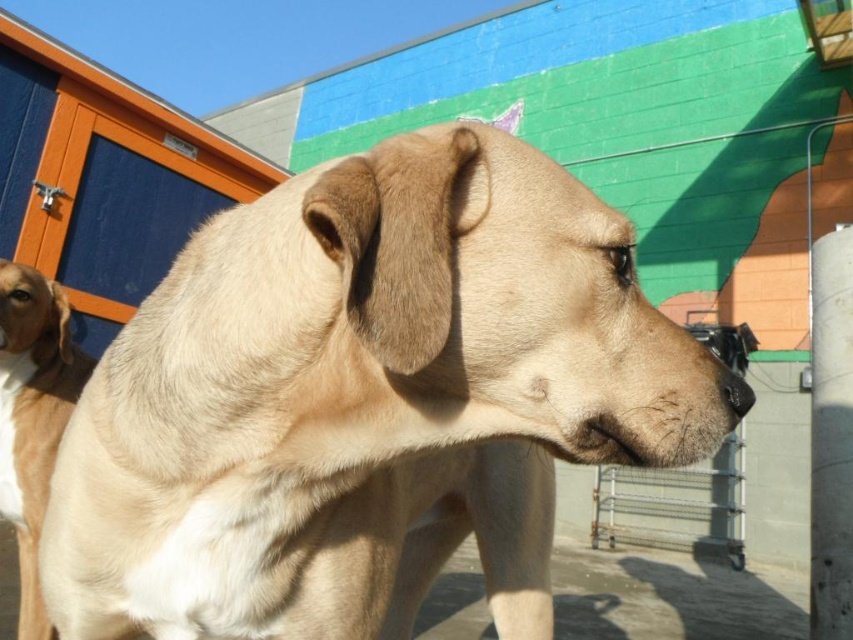
You are a photographer setting up a shoot with the fuzzy beige dog at center and the light brown fur at left. Which of the two subjects should you focus on if you want to capture the larger subject in your frame?

The fuzzy beige dog at center is larger in size than the light brown fur at left, so you should focus on the fuzzy beige dog at center to capture the larger subject in your frame.

You are a photographer trying to capture the fuzzy beige dog at center and the light brown fur at left in the same frame. Based on their positions, which one is higher up in the image?

The fuzzy beige dog at center is located above the light brown fur at left, so it is higher up in the image.

From the picture: You are a photographer trying to capture a clear shot of the fuzzy beige dog at center and the light brown fur at left. Since the dog is moving, you need to focus your camera first. Which object should you focus on first to ensure it appears sharp in the photo?

The fuzzy beige dog at center should be focused on first because it is in front of the light brown fur at left, so focusing on it will ensure it appears sharp while the background may blur slightly.